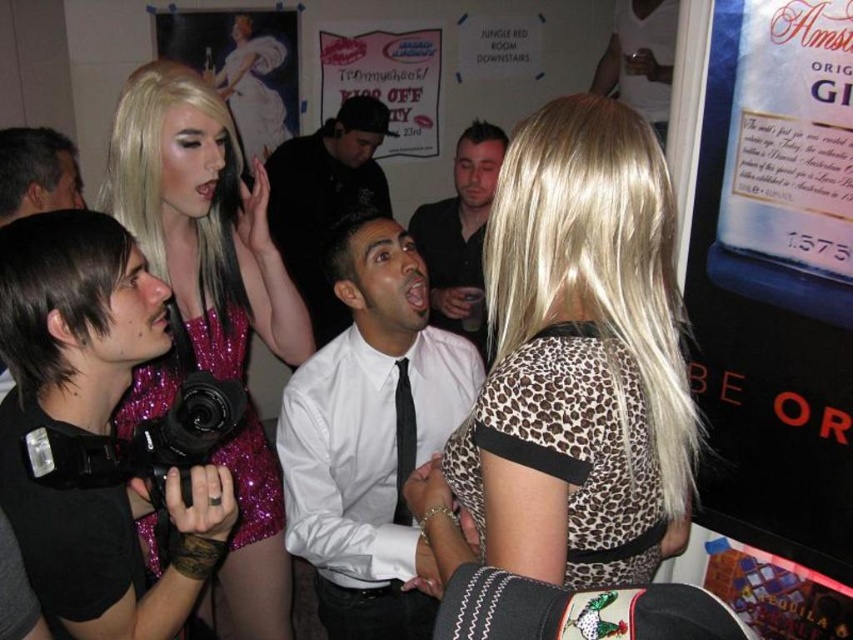
Question: Can you confirm if sparkly pink dress at left is thinner than black silk tie at center?

Choices:
 (A) yes
 (B) no

Answer: (B)

Question: Estimate the real-world distances between objects in this image. Which object is farther from the shiny pink wig at upper left?

Choices:
 (A) tequila label at lower right
 (B) black plastic video camera at lower left
 (C) leopard print dress at center

Answer: (C)

Question: Estimate the real-world distances between objects in this image. Which object is closer to the shiny pink wig at upper left?

Choices:
 (A) dark brown leather jacket at upper left
 (B) white paper poster at center

Answer: (B)

Question: Does black plastic video camera at lower left come behind white paper poster at center?

Choices:
 (A) no
 (B) yes

Answer: (A)

Question: Estimate the real-world distances between objects in this image. Which object is closer to the black plastic video camera at lower left?

Choices:
 (A) tequila label at lower right
 (B) black shirt at center

Answer: (A)

Question: Does black matte camera at left have a larger size compared to white paper poster at center?

Choices:
 (A) yes
 (B) no

Answer: (B)